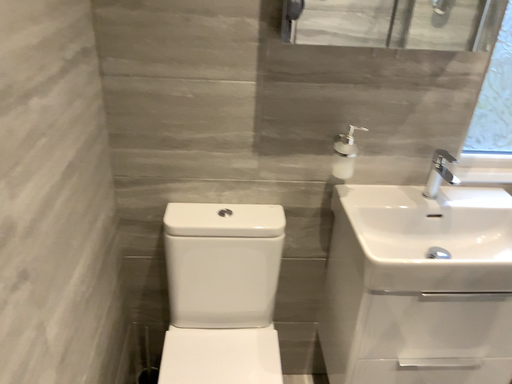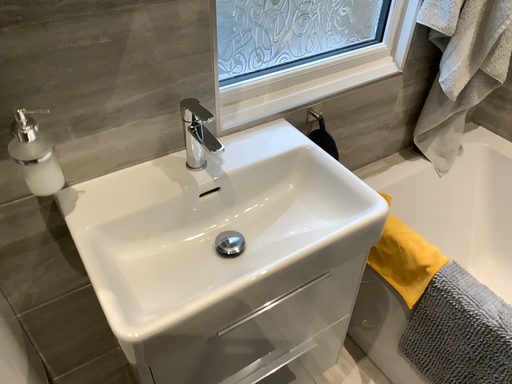
Question: How did the camera likely rotate when shooting the video?

Choices:
 (A) rotated left
 (B) rotated right

Answer: (B)